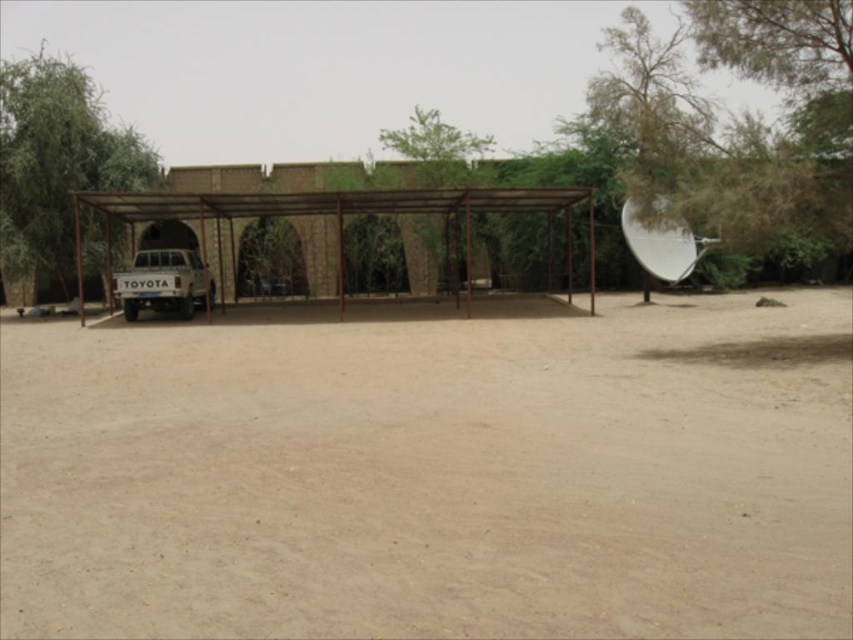
Question: Can you confirm if green leafy tree at left is positioned below brown metal carport at center?

Choices:
 (A) no
 (B) yes

Answer: (A)

Question: Which of the following is the farthest from the observer?

Choices:
 (A) (196, 275)
 (B) (53, 164)

Answer: (B)

Question: Which point is farther to the camera?

Choices:
 (A) green leafy tree at left
 (B) brown metal carport at center
 (C) green leafy tree at center
 (D) brown sandy dirt track at center

Answer: (C)

Question: Is brown sandy dirt track at center smaller than brown metal carport at center?

Choices:
 (A) yes
 (B) no

Answer: (A)

Question: Is brown metal carport at center behind white matte truck at left?

Choices:
 (A) yes
 (B) no

Answer: (B)

Question: Among these objects, which one is farthest from the camera?

Choices:
 (A) green leafy tree at center
 (B) brown sandy dirt track at center
 (C) brown metal carport at center
 (D) green leafy tree at left

Answer: (A)